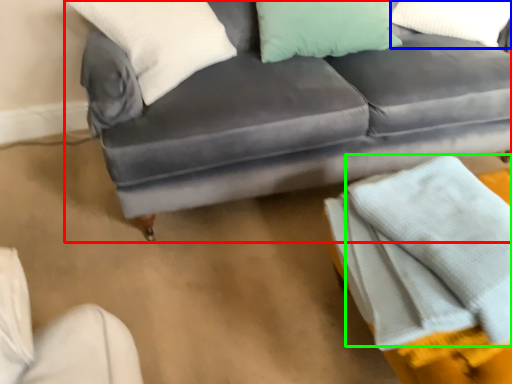
Question: Estimate the real-world distances between objects in this image. Which object is closer to studio couch (highlighted by a red box), pillow (highlighted by a blue box) or blanket (highlighted by a green box)?

Choices:
 (A) pillow
 (B) blanket

Answer: (A)